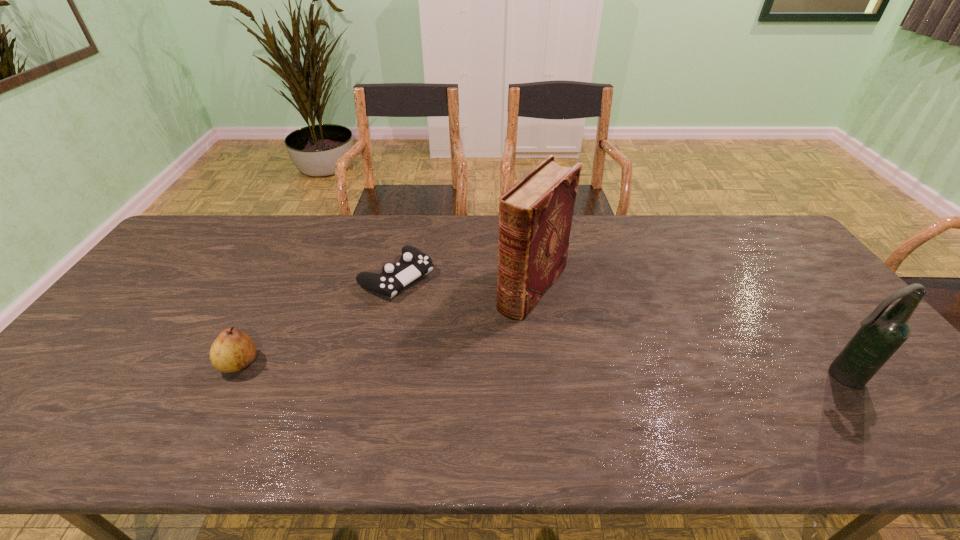
I want to click on vacant spot on the desktop that is between the pear and the third shortest object and is positioned on the surface of the third object from right to left, so [538, 370].

Locate an element on the screen. free spot on the desktop that is between the leftmost object and the rightmost object and is positioned on the spine side of the third object from left to right is located at coordinates (464, 368).